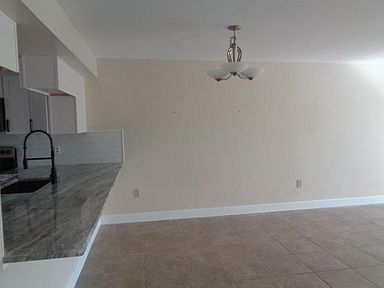
The image size is (384, 288). I want to click on floor, so click(x=226, y=275).